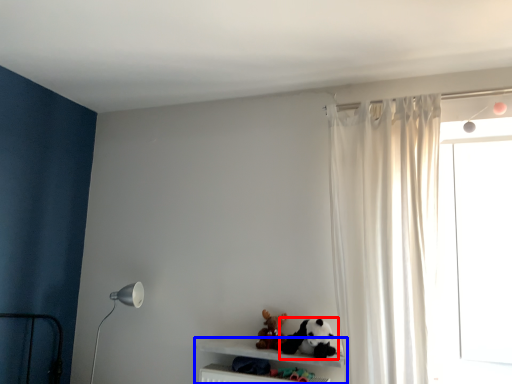
Question: Which object appears closest to the camera in this image, toy (highlighted by a red box) or shelf (highlighted by a blue box)?

Choices:
 (A) toy
 (B) shelf

Answer: (B)